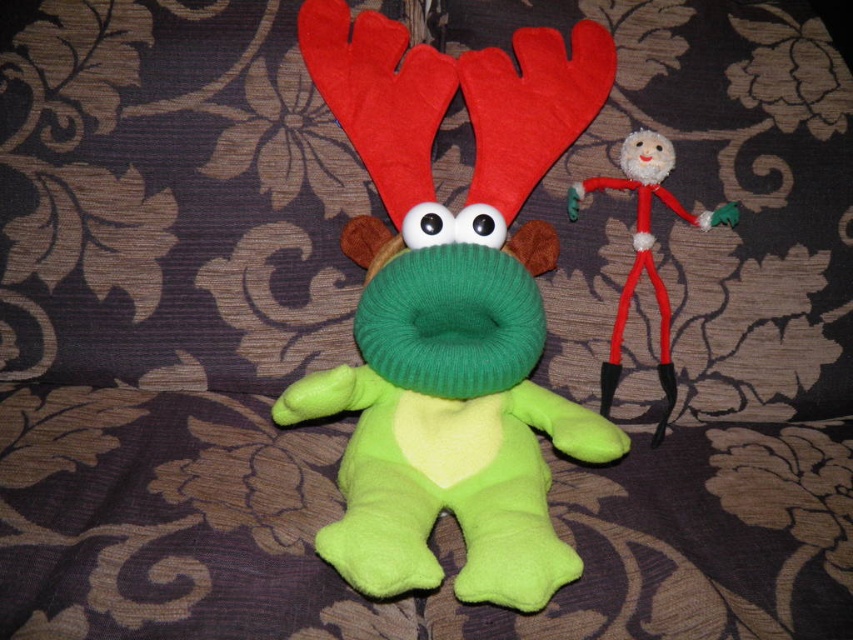
In the scene shown: You are organizing a childrens party and need to arrange the green soft plush toy at center and the fuzzy red stick figure at upper right on a shelf. If the shelf has limited space, which toy should be placed first to ensure both fit properly?

The green soft plush toy at center should be placed first since it is to the left of the fuzzy red stick figure at upper right, so positioning it first allows proper alignment for both to fit on the shelf.

In the scene shown: You are looking at the two handmade plush toys in the image. The first toy is at point (378, 176) and the second is at point (628, 157). Which of these points is closer to you?

Point (378, 176) is closer to the viewer than point (628, 157).

You are a toy organizer who needs to arrange the green soft plush toy at center and the fuzzy red stick figure at upper right on a shelf. The shelf has a maximum width of 8 inches. Can both toys fit side by side on the shelf without overlapping?

The distance between the green soft plush toy at center and the fuzzy red stick figure at upper right is 7.77 inches, which is less than the shelf width of 8 inches. Therefore, both toys can fit side by side on the shelf without overlapping.